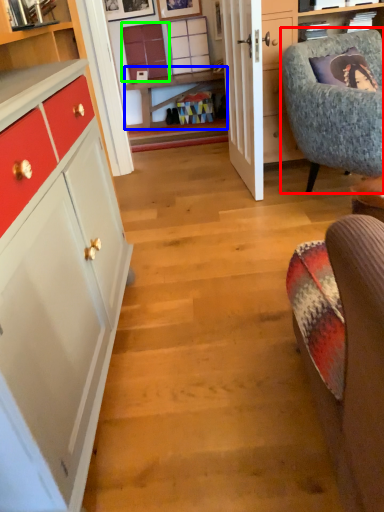
Question: Estimate the real-world distances between objects in this image. Which object is closer to chair (highlighted by a red box), table (highlighted by a blue box) or cabinetry (highlighted by a green box)?

Choices:
 (A) table
 (B) cabinetry

Answer: (A)